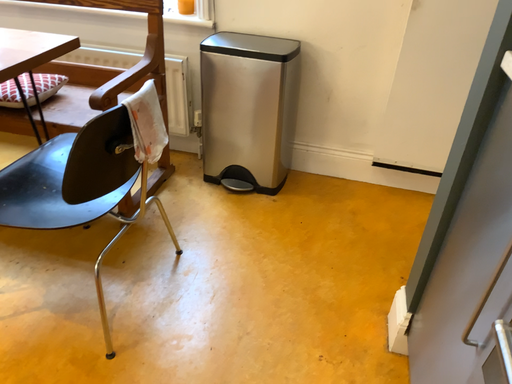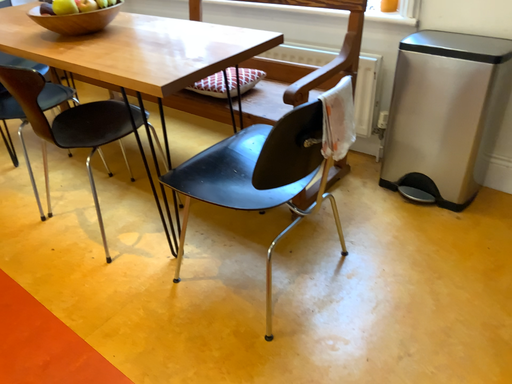
Question: Which way did the camera rotate in the video?

Choices:
 (A) rotated left
 (B) rotated right

Answer: (A)